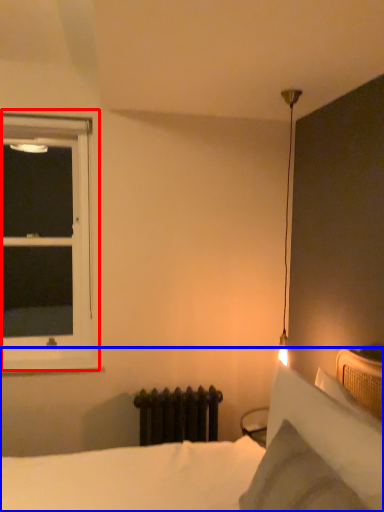
Question: Among these objects, which one is nearest to the camera, window (highlighted by a red box) or bed (highlighted by a blue box)?

Choices:
 (A) window
 (B) bed

Answer: (B)